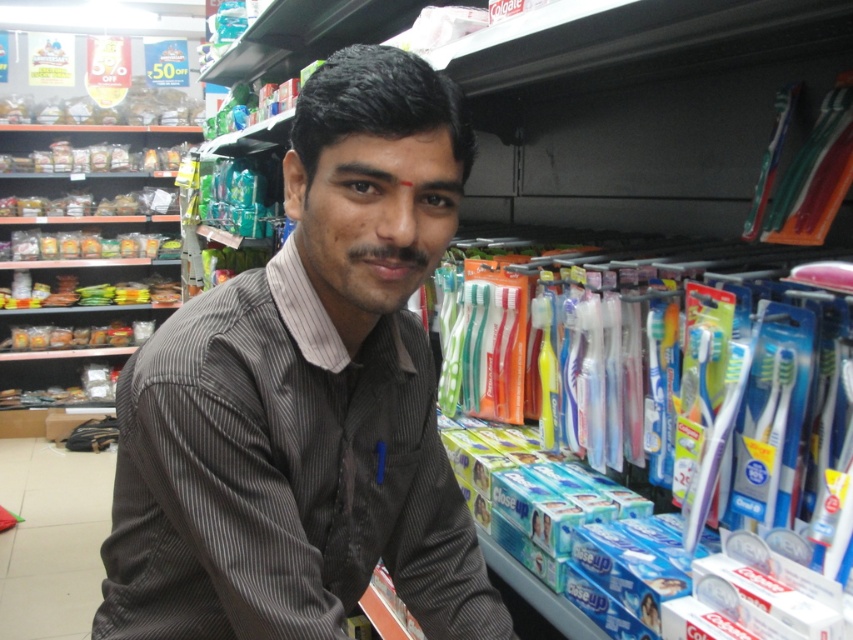
Can you confirm if dark gray striped shirt at center is positioned below translucent plastic toothbrush at upper right?

Yes.

Between dark gray striped shirt at center and translucent plastic toothbrush at upper right, which one is positioned lower?

dark gray striped shirt at center

Locate an element on the screen. The width and height of the screenshot is (853, 640). dark gray striped shirt at center is located at coordinates (306, 397).

The width and height of the screenshot is (853, 640). Describe the element at coordinates (735, 403) in the screenshot. I see `translucent plastic toothbrush at right` at that location.

Is translucent plastic toothbrush at right above translucent plastic toothbrush at upper right?

Incorrect, translucent plastic toothbrush at right is not positioned above translucent plastic toothbrush at upper right.

Locate an element on the screen. The width and height of the screenshot is (853, 640). translucent plastic toothbrush at right is located at coordinates (735, 403).

Does dark gray striped shirt at center have a lesser height compared to translucent plastic toothbrush at right?

No.

Does dark gray striped shirt at center lie behind translucent plastic toothbrush at right?

No, dark gray striped shirt at center is in front of translucent plastic toothbrush at right.

What do you see at coordinates (306, 397) in the screenshot?
I see `dark gray striped shirt at center` at bounding box center [306, 397].

I want to click on dark gray striped shirt at center, so click(306, 397).